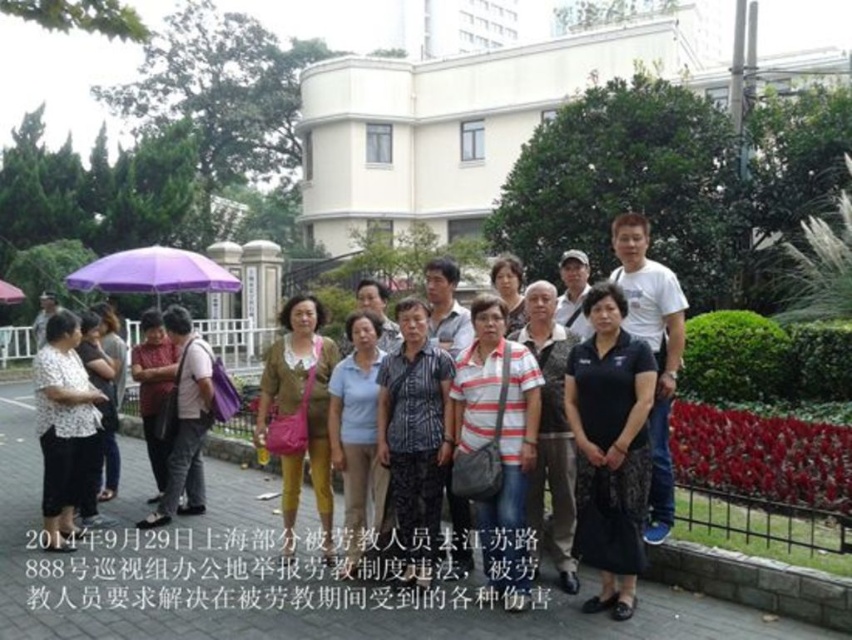
Does striped cotton shirt at center have a lesser height compared to matte black shirt at center?

No.

Who is lower down, striped cotton shirt at center or matte black shirt at center?

striped cotton shirt at center is below.

The width and height of the screenshot is (852, 640). What are the coordinates of `striped cotton shirt at center` in the screenshot? It's located at (499, 442).

Locate an element on the screen. striped cotton shirt at center is located at coordinates (499, 442).

Does purple matte umbrella at left appear over purple fabric umbrella at center?

Indeed, purple matte umbrella at left is positioned over purple fabric umbrella at center.

Is point (160, 272) less distant than point (1, 292)?

Yes, it is.

Find the location of a particular element. purple matte umbrella at left is located at coordinates (153, 273).

In the scene shown: Is matte black dress at lower left in front of matte black shirt at center?

Yes.

Who is higher up, matte black dress at lower left or matte black shirt at center?

Positioned higher is matte black shirt at center.

Find the location of a particular element. matte black dress at lower left is located at coordinates (98, 408).